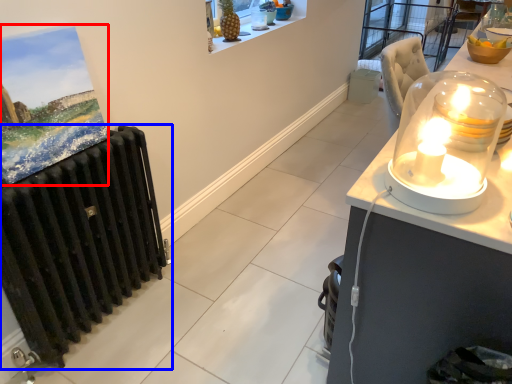
Question: Which object is closer to the camera taking this photo, picture frame (highlighted by a red box) or radiator (highlighted by a blue box)?

Choices:
 (A) picture frame
 (B) radiator

Answer: (A)